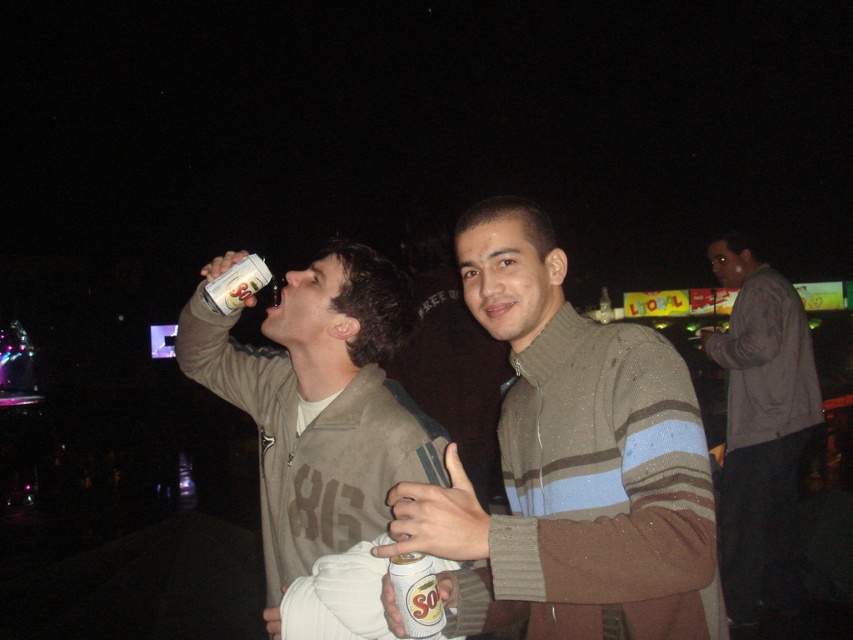
Question: Does gray sweater at right appear under metallic silver can at upper left?

Choices:
 (A) no
 (B) yes

Answer: (B)

Question: Which of the following is the closest to the observer?

Choices:
 (A) (421, 624)
 (B) (247, 289)
 (C) (735, 596)

Answer: (A)

Question: Is shiny brown sweater at center thinner than metallic silver can at upper left?

Choices:
 (A) yes
 (B) no

Answer: (A)

Question: Which of these objects is positioned closest to the shiny brown sweater at center?

Choices:
 (A) metallic silver can at upper left
 (B) gray sweater at right

Answer: (A)

Question: Among these objects, which one is nearest to the camera?

Choices:
 (A) shiny brown sweater at center
 (B) metallic silver can at upper left
 (C) matte gray jacket at center

Answer: (A)

Question: In this image, where is shiny brown sweater at center located relative to gray sweater at right?

Choices:
 (A) above
 (B) below

Answer: (A)